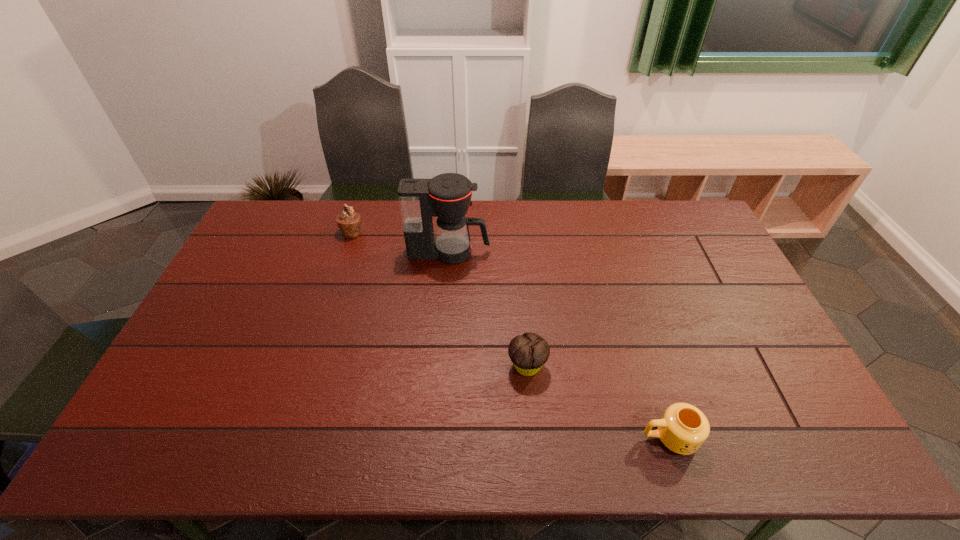
This screenshot has width=960, height=540. Identify the location of coffee maker. (447, 196).

Image resolution: width=960 pixels, height=540 pixels. In order to click on the third object from right to left in this screenshot , I will do `click(447, 196)`.

This screenshot has width=960, height=540. In order to click on the farther muffin in this screenshot , I will do `click(349, 222)`.

Identify the location of the left muffin. This screenshot has width=960, height=540. tap(349, 222).

What are the coordinates of `the right muffin` in the screenshot? It's located at (529, 352).

At what (x,y) coordinates should I click in order to perform the action: click on the third farthest object. Please return your answer as a coordinate pair (x, y). This screenshot has height=540, width=960. Looking at the image, I should click on (529, 352).

The width and height of the screenshot is (960, 540). I want to click on the nearest object, so click(x=683, y=428).

This screenshot has height=540, width=960. I want to click on mug, so click(683, 428).

In order to click on free location located 0.380m pour from the carafe of the coffee maker in this screenshot , I will do `click(600, 252)`.

Find the location of a particular element. This screenshot has height=540, width=960. free region located 0.220m on the front of the farther muffin is located at coordinates (335, 285).